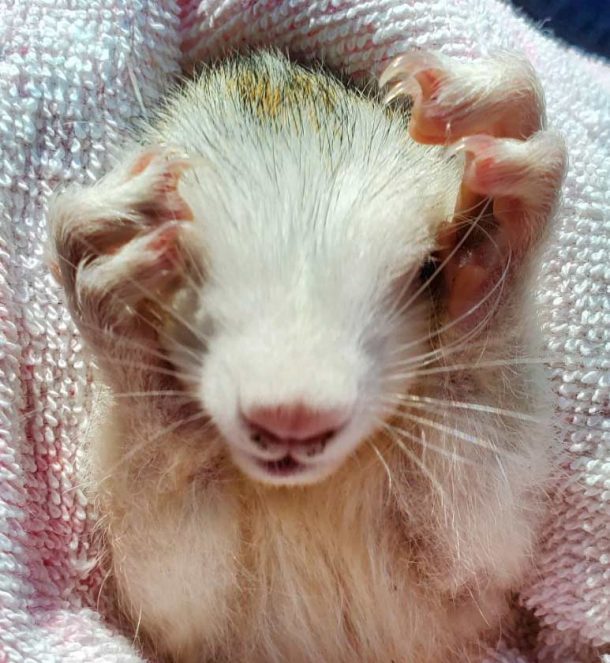
Identify the location of pink and white towel. This screenshot has height=663, width=610. (84, 88).